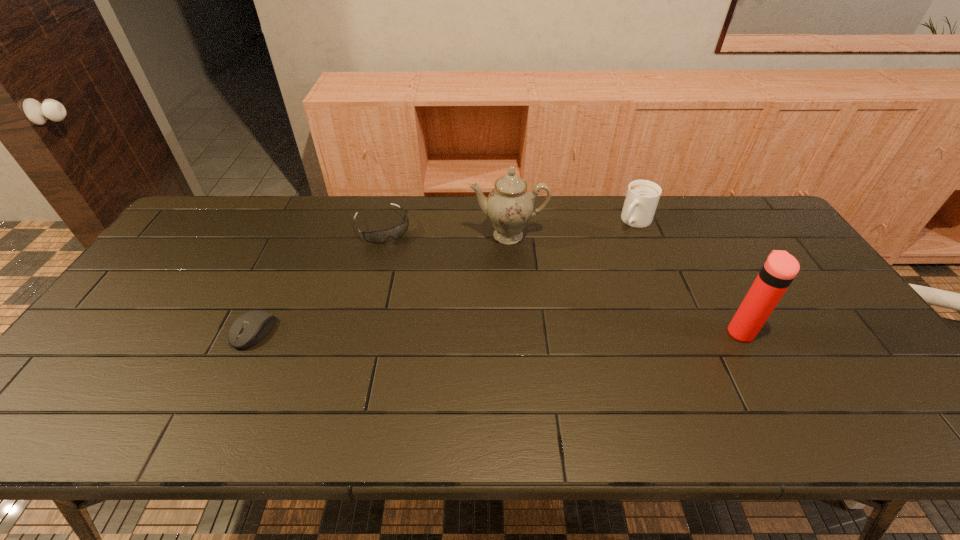
The image size is (960, 540). I want to click on computer equipment, so click(248, 329).

Identify the location of the shortest object. (248, 329).

In order to click on the rightmost object in this screenshot , I will do `click(780, 268)`.

The width and height of the screenshot is (960, 540). What are the coordinates of `the third object from left to right` in the screenshot? It's located at (510, 205).

This screenshot has height=540, width=960. In order to click on goggles in this screenshot , I will do `click(374, 236)`.

This screenshot has width=960, height=540. I want to click on the fourth tallest object, so click(374, 236).

What are the coordinates of `cappuccino` in the screenshot? It's located at (642, 197).

Locate an element on the screen. The image size is (960, 540). the fourth object from left to right is located at coordinates (642, 197).

Where is `free space located 0.150m on the back of the computer equipment`? The image size is (960, 540). free space located 0.150m on the back of the computer equipment is located at coordinates (280, 275).

Identify the location of vacant region located 0.100m on the right of the thermos bottle. Image resolution: width=960 pixels, height=540 pixels. (791, 332).